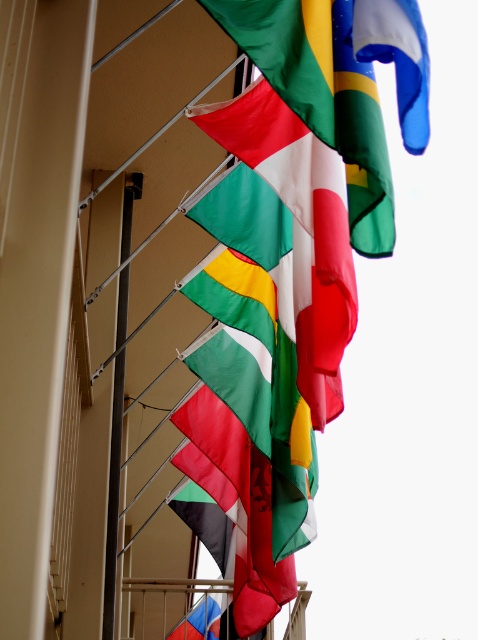
Question: Does textured fabric flag at center appear on the left side of polyester flag at center?

Choices:
 (A) yes
 (B) no

Answer: (A)

Question: Estimate the real-world distances between objects in this image. Which object is farther from the polyester flag at center?

Choices:
 (A) textured fabric flag at center
 (B) silver metallic pole at center

Answer: (B)

Question: Does polyester flag at center lie in front of silver metallic pole at center?

Choices:
 (A) yes
 (B) no

Answer: (A)

Question: Is textured fabric flag at center smaller than polyester flag at center?

Choices:
 (A) no
 (B) yes

Answer: (A)

Question: Which object appears farthest from the camera in this image?

Choices:
 (A) silver metallic pole at center
 (B) textured fabric flag at center

Answer: (A)

Question: Which object appears closest to the camera in this image?

Choices:
 (A) textured fabric flag at center
 (B) polyester flag at center

Answer: (B)